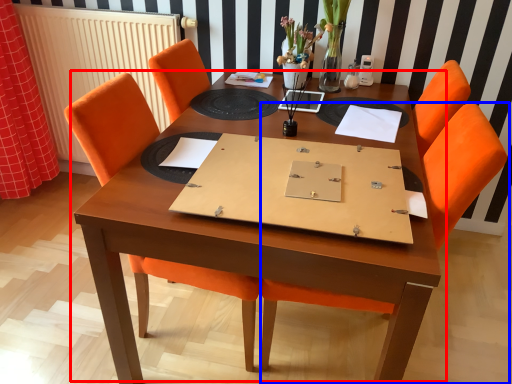
Question: Which of the following is the farthest to the observer, table (highlighted by a red box) or chair (highlighted by a blue box)?

Choices:
 (A) table
 (B) chair

Answer: (B)